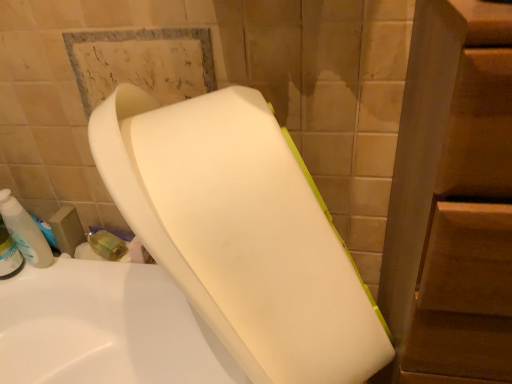
Question: Considering the relative sizes of translucent plastic soap dispenser at left and white matte toilet at center in the image provided, is translucent plastic soap dispenser at left thinner than white matte toilet at center?

Choices:
 (A) yes
 (B) no

Answer: (A)

Question: Is translucent plastic soap dispenser at left to the left of white matte toilet at center from the viewer's perspective?

Choices:
 (A) yes
 (B) no

Answer: (A)

Question: Is translucent plastic soap dispenser at left taller than white matte toilet at center?

Choices:
 (A) yes
 (B) no

Answer: (B)

Question: Is translucent plastic soap dispenser at left positioned far away from white matte toilet at center?

Choices:
 (A) no
 (B) yes

Answer: (A)

Question: Is translucent plastic soap dispenser at left placed right next to white matte toilet at center?

Choices:
 (A) no
 (B) yes

Answer: (A)

Question: Is translucent plastic soap dispenser at left facing towards white matte toilet at center?

Choices:
 (A) yes
 (B) no

Answer: (B)

Question: Does white matte toilet at center lie in front of translucent plastic soap dispenser at left?

Choices:
 (A) no
 (B) yes

Answer: (B)

Question: Is white matte toilet at center thinner than translucent plastic soap dispenser at left?

Choices:
 (A) yes
 (B) no

Answer: (B)

Question: From the image's perspective, is white matte toilet at center above translucent plastic soap dispenser at left?

Choices:
 (A) yes
 (B) no

Answer: (B)

Question: Is white matte toilet at center looking in the opposite direction of translucent plastic soap dispenser at left?

Choices:
 (A) no
 (B) yes

Answer: (A)

Question: Are white matte toilet at center and translucent plastic soap dispenser at left beside each other?

Choices:
 (A) yes
 (B) no

Answer: (B)

Question: Is white matte toilet at center taller than translucent plastic soap dispenser at left?

Choices:
 (A) no
 (B) yes

Answer: (B)

Question: Would you say translucent plastic soap dispenser at left is inside or outside white matte toilet at center?

Choices:
 (A) outside
 (B) inside

Answer: (A)